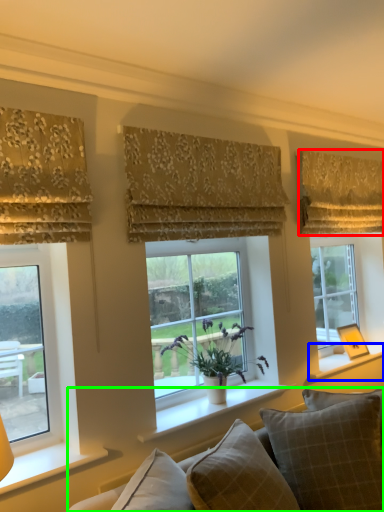
Question: Which object is the farthest from curtain (highlighted by a red box)? Choose among these: window sill (highlighted by a blue box) or studio couch (highlighted by a green box).

Choices:
 (A) window sill
 (B) studio couch

Answer: (B)